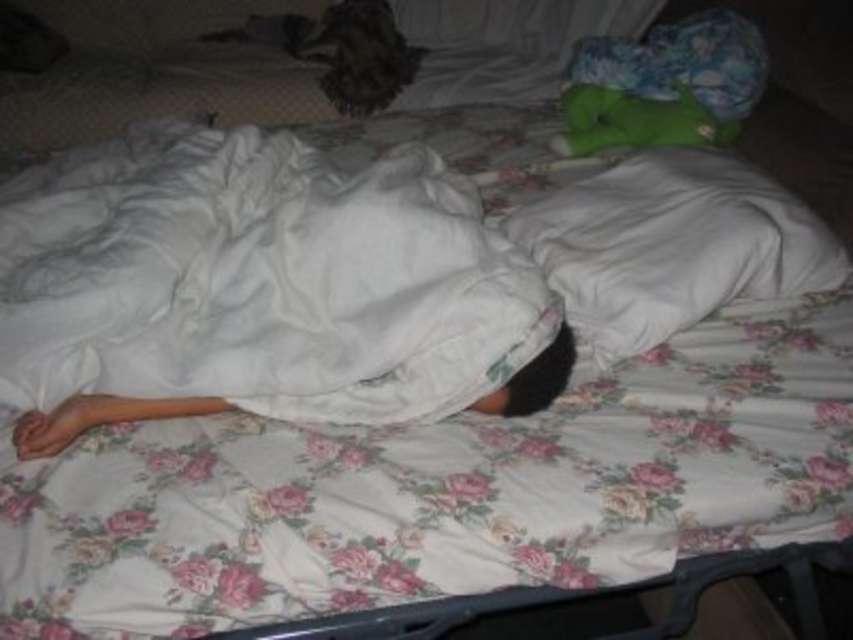
Which of these two, white cotton blanket at center or green plush toy at upper right, stands taller?

Standing taller between the two is white cotton blanket at center.

Describe the element at coordinates (260, 280) in the screenshot. The width and height of the screenshot is (853, 640). I see `white cotton blanket at center` at that location.

Between point (122, 262) and point (637, 118), which one is positioned in front?

Positioned in front is point (122, 262).

The width and height of the screenshot is (853, 640). What are the coordinates of `white cotton blanket at center` in the screenshot? It's located at (260, 280).

Who is higher up, fuzzy brown cat at upper center or green plush toy at upper right?

fuzzy brown cat at upper center is higher up.

Locate an element on the screen. The height and width of the screenshot is (640, 853). fuzzy brown cat at upper center is located at coordinates (341, 51).

Which is more to the right, white cotton blanket at center or fuzzy brown cat at upper center?

white cotton blanket at center is more to the right.

Does point (440, 321) come closer to viewer compared to point (379, 102)?

Yes, it is in front of point (379, 102).

Who is more forward, (76, 148) or (257, 20)?

Point (76, 148)

Locate an element on the screen. white cotton blanket at center is located at coordinates (260, 280).